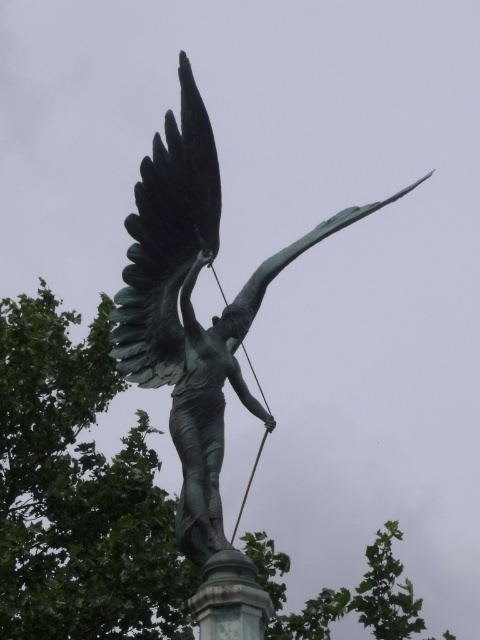
Question: Which is farther from the green polished stone pillar at center?

Choices:
 (A) green leafy tree at upper left
 (B) bronze statue at center

Answer: (A)

Question: Considering the relative positions of green leafy tree at upper left and green polished stone pillar at center in the image provided, where is green leafy tree at upper left located with respect to green polished stone pillar at center?

Choices:
 (A) left
 (B) right

Answer: (A)

Question: Is green leafy tree at upper left to the right of green polished stone pillar at center from the viewer's perspective?

Choices:
 (A) no
 (B) yes

Answer: (A)

Question: Which object is farther from the camera taking this photo?

Choices:
 (A) bronze statue at center
 (B) green leafy tree at upper left
 (C) green polished stone pillar at center

Answer: (B)

Question: Is bronze statue at center below green polished stone pillar at center?

Choices:
 (A) no
 (B) yes

Answer: (A)

Question: Based on their relative distances, which object is farther from the green polished stone pillar at center?

Choices:
 (A) bronze statue at center
 (B) green leafy tree at upper left

Answer: (B)